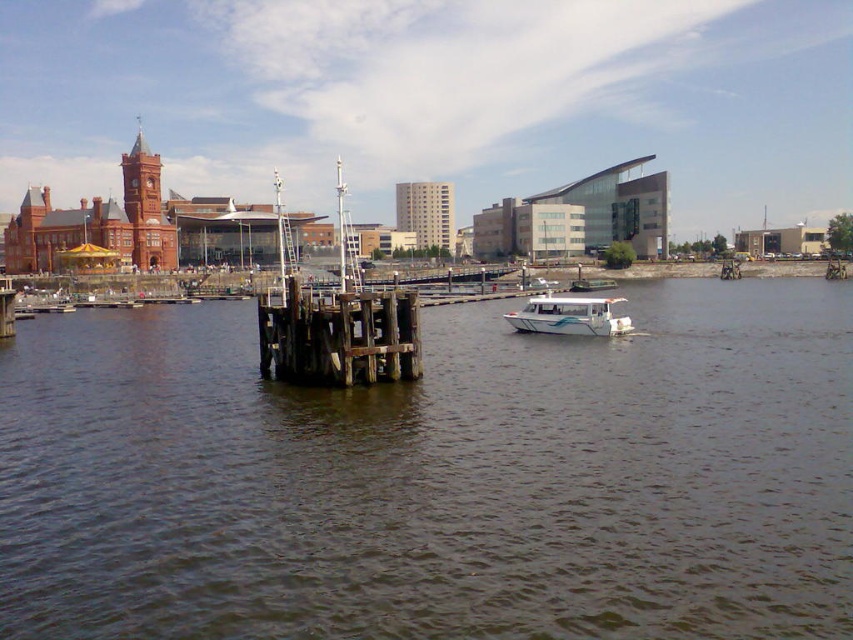
Question: Does brown wooden dock at center appear under wooden at center?

Choices:
 (A) no
 (B) yes

Answer: (B)

Question: Is wooden at center bigger than white glossy boat at center?

Choices:
 (A) yes
 (B) no

Answer: (A)

Question: Among these objects, which one is nearest to the camera?

Choices:
 (A) brown wooden dock at center
 (B) white glossy boat at center

Answer: (A)

Question: Which point is farther to the camera?

Choices:
 (A) white glossy boat at center
 (B) brown wooden dock at center

Answer: (A)

Question: Considering the relative positions of brown wooden dock at center and white glossy boat at center in the image provided, where is brown wooden dock at center located with respect to white glossy boat at center?

Choices:
 (A) above
 (B) below

Answer: (B)

Question: Among these objects, which one is farthest from the camera?

Choices:
 (A) brown wooden dock at center
 (B) white glossy boat at center

Answer: (B)